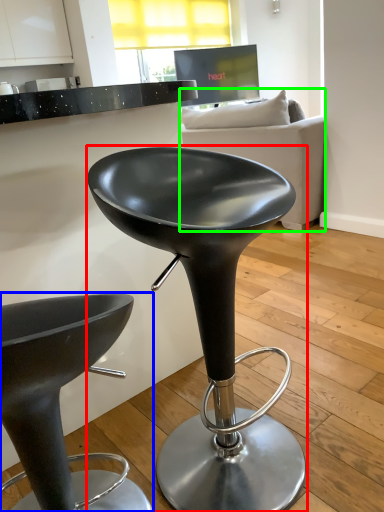
Question: Which is nearer to the stool (highlighted by a red box)? stool (highlighted by a blue box) or studio couch (highlighted by a green box).

Choices:
 (A) stool
 (B) studio couch

Answer: (A)